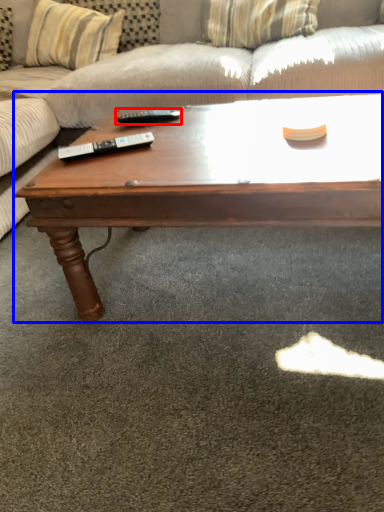
Question: Which of the following is the farthest to the observer, remote (highlighted by a red box) or coffee table (highlighted by a blue box)?

Choices:
 (A) remote
 (B) coffee table

Answer: (A)